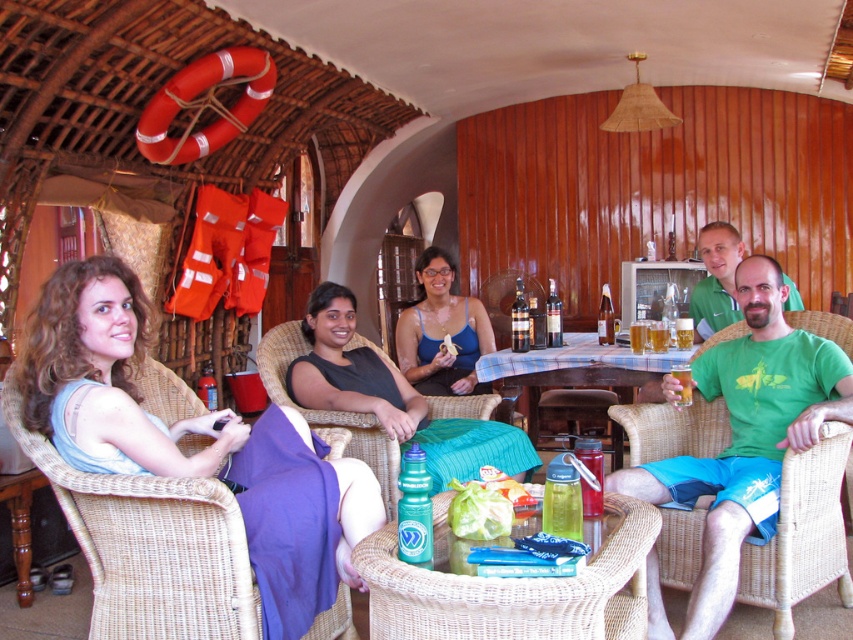
Question: Does translucent plastic table at center lie in front of brown wooden table at lower left?

Choices:
 (A) no
 (B) yes

Answer: (B)

Question: Which object appears closest to the camera in this image?

Choices:
 (A) translucent plastic table at center
 (B) translucent glass cup at center
 (C) clear plastic bottle at center

Answer: (A)

Question: Is clear plastic bottle at center behind translucent glass cup at center?

Choices:
 (A) yes
 (B) no

Answer: (B)

Question: Which object is positioned closest to the translucent plastic table at center?

Choices:
 (A) brown wooden table at lower left
 (B) green matte shirt at center
 (C) matte blue tank top at center
 (D) green cotton t-shirt at right

Answer: (D)

Question: Is woven wicker chair at center closer to camera compared to translucent glass cup at center?

Choices:
 (A) no
 (B) yes

Answer: (A)

Question: Which object appears closest to the camera in this image?

Choices:
 (A) brown wooden table at lower left
 (B) clear plastic bottle at center
 (C) matte blue tank top at center
 (D) translucent plastic table at center

Answer: (D)